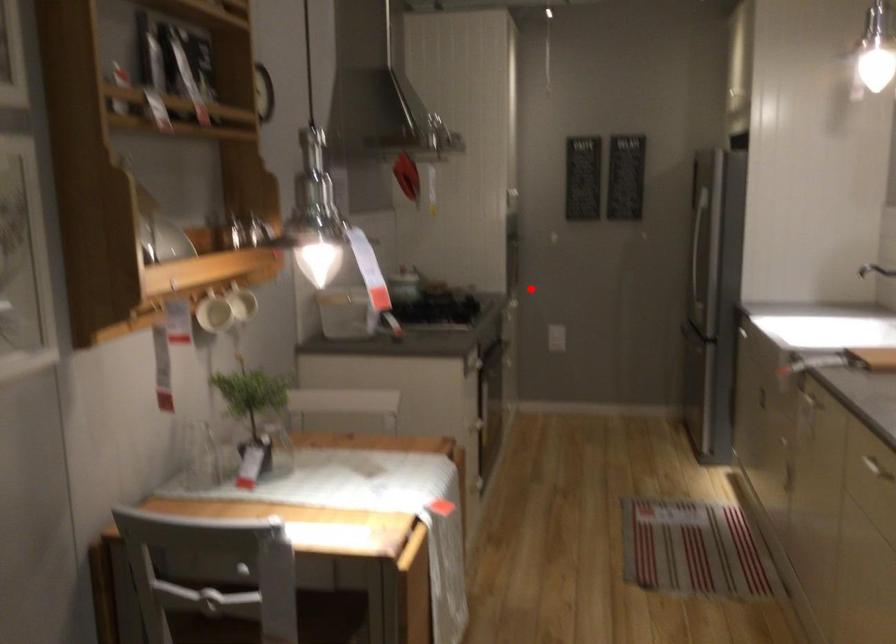
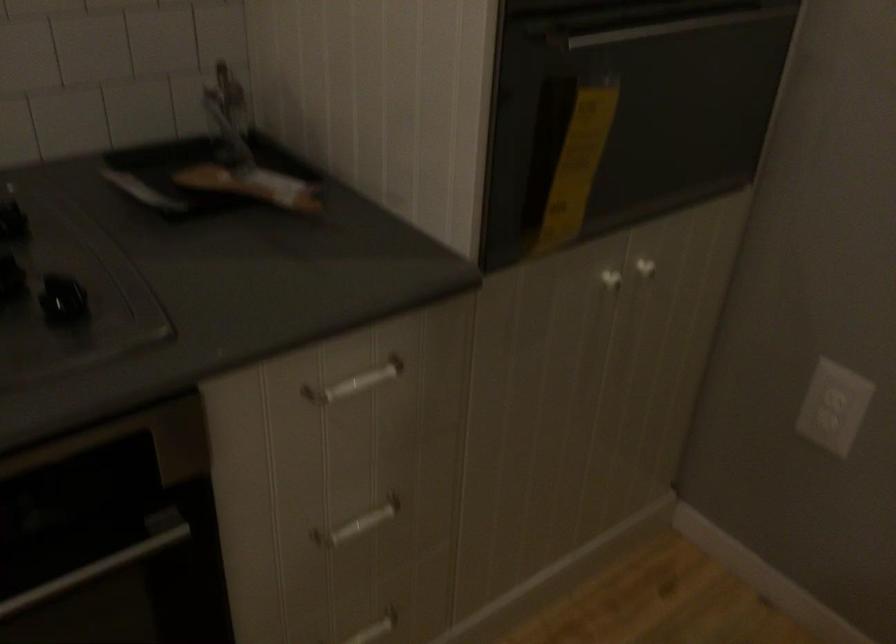
Where in the second image is the point corresponding to the highlighted location from the first image?

(609, 278)